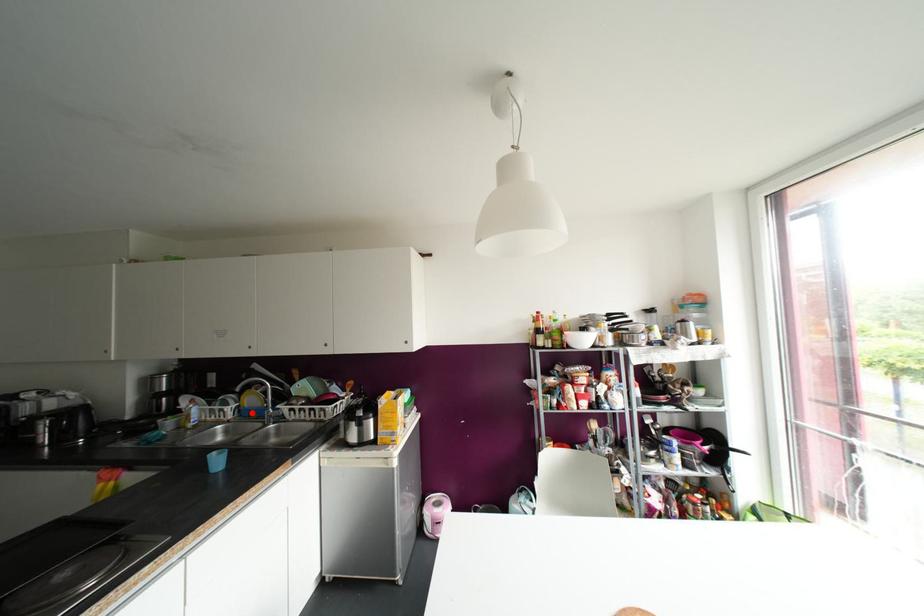
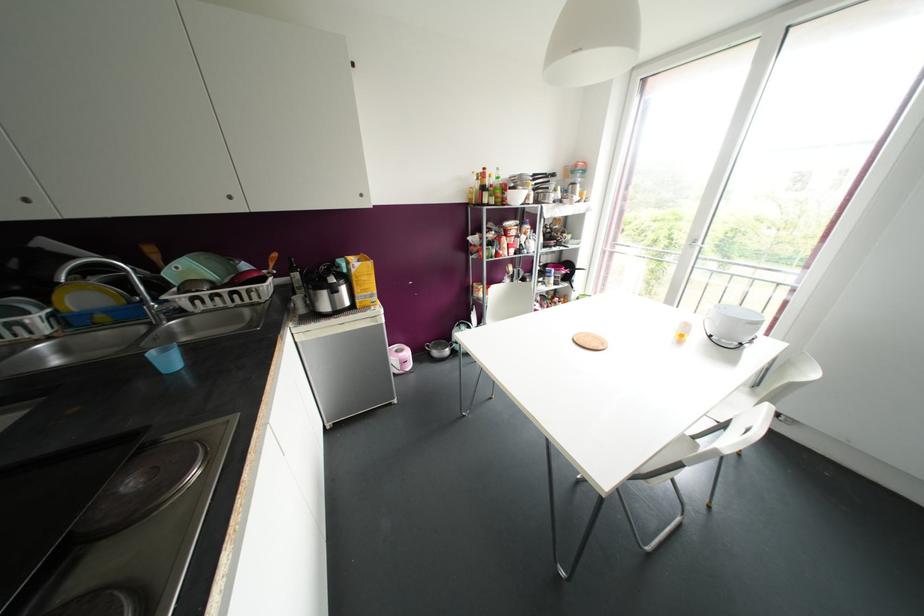
Find the pixel in the second image that matches the highlighted location in the first image.

(101, 317)